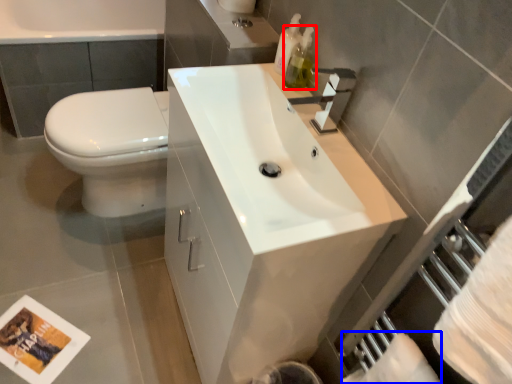
Question: Which of the following is the closest to the observer, soap dispenser (highlighted by a red box) or toilet paper (highlighted by a blue box)?

Choices:
 (A) soap dispenser
 (B) toilet paper

Answer: (B)